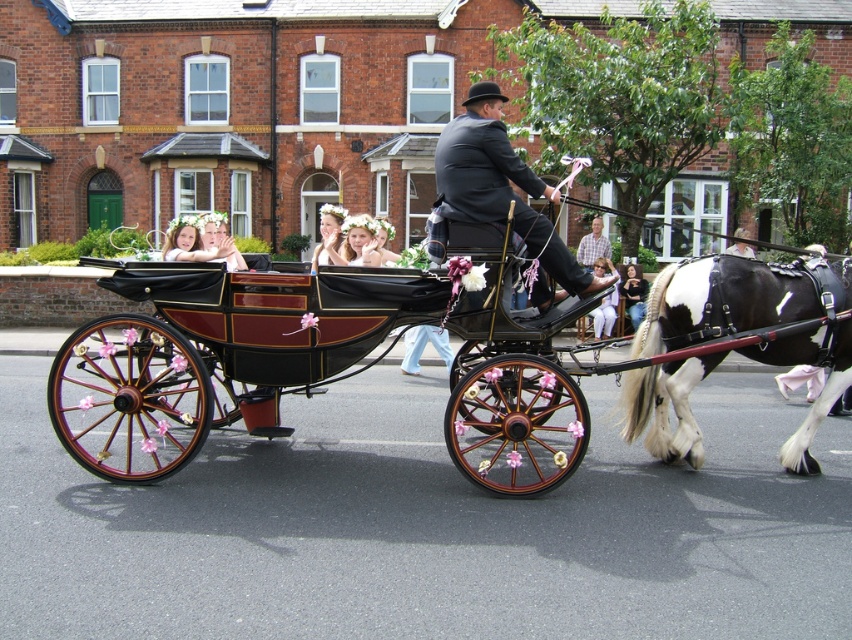
Question: Does shiny black coach at center have a greater width compared to matte black dress at center?

Choices:
 (A) no
 (B) yes

Answer: (B)

Question: Which object appears closest to the camera in this image?

Choices:
 (A) matte black dress at center
 (B) white cotton dress at center

Answer: (B)

Question: Does black and white speckled horse at right come behind plaid shirt at center?

Choices:
 (A) yes
 (B) no

Answer: (B)

Question: Which object appears farthest from the camera in this image?

Choices:
 (A) white cotton dress at center
 (B) matte black dress at center
 (C) black and white speckled horse at right
 (D) shiny black coach at center

Answer: (B)

Question: Does shiny black coach at center lie in front of plaid shirt at center?

Choices:
 (A) no
 (B) yes

Answer: (B)

Question: Which of the following is the closest to the observer?

Choices:
 (A) (469, 404)
 (B) (825, 401)
 (C) (586, 244)

Answer: (B)